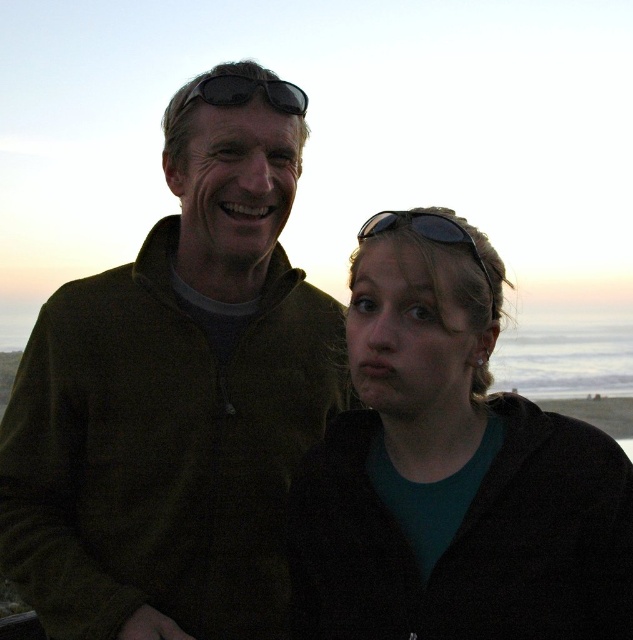
Question: Which object appears farthest from the camera in this image?

Choices:
 (A) black plastic sunglasses at upper center
 (B) dark green fleece at left

Answer: (B)

Question: Which of the following is the farthest from the observer?

Choices:
 (A) black matte sunglasses at upper center
 (B) matte black jacket at center
 (C) dark green fleece at left
 (D) black plastic sunglasses at upper center

Answer: (A)

Question: Is matte black jacket at center thinner than black matte sunglasses at upper center?

Choices:
 (A) no
 (B) yes

Answer: (A)

Question: Among these points, which one is farthest from the camera?

Choices:
 (A) (429, 228)
 (B) (229, 83)
 (C) (465, 484)

Answer: (B)

Question: From the image, what is the correct spatial relationship of dark green fleece at left in relation to black plastic sunglasses at upper center?

Choices:
 (A) above
 (B) below

Answer: (B)

Question: Is dark green fleece at left closer to the viewer compared to black matte sunglasses at upper center?

Choices:
 (A) no
 (B) yes

Answer: (B)